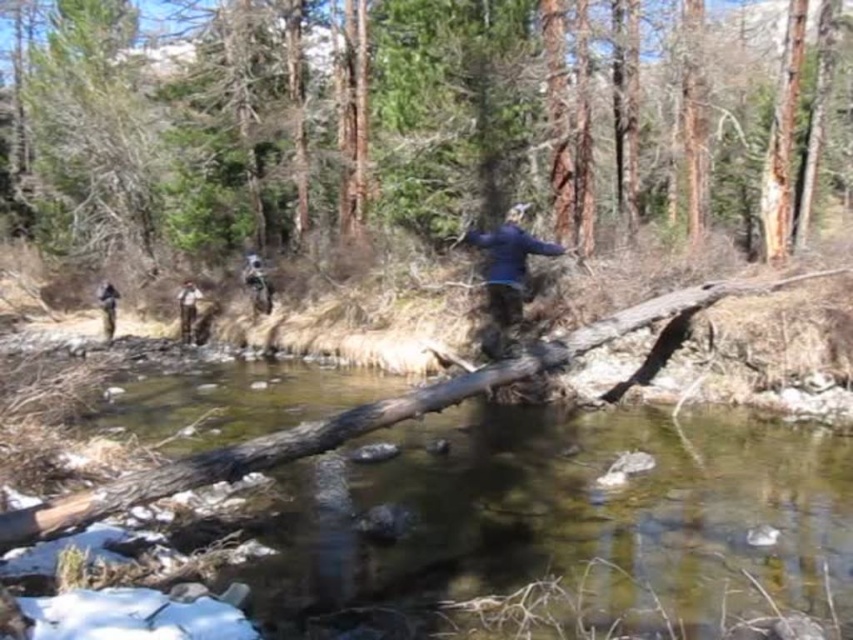
Question: Which point appears closest to the camera in this image?

Choices:
 (A) (503, 259)
 (B) (257, 291)

Answer: (A)

Question: Which of these objects is positioned closest to the brown rough log at center?

Choices:
 (A) camouflage pants at left
 (B) dark blue jacket at center

Answer: (B)

Question: Is transparent water at center wider than camouflage fabric jacket at center?

Choices:
 (A) no
 (B) yes

Answer: (B)

Question: Considering the relative positions of blue matte jacket at center and camouflage fabric jacket at center in the image provided, where is blue matte jacket at center located with respect to camouflage fabric jacket at center?

Choices:
 (A) below
 (B) above

Answer: (B)

Question: Does brown rough log at center have a smaller size compared to blue matte jacket at center?

Choices:
 (A) no
 (B) yes

Answer: (A)

Question: Which point is closer to the camera taking this photo?

Choices:
 (A) (263, 285)
 (B) (578, 58)
 (C) (737, 481)

Answer: (C)